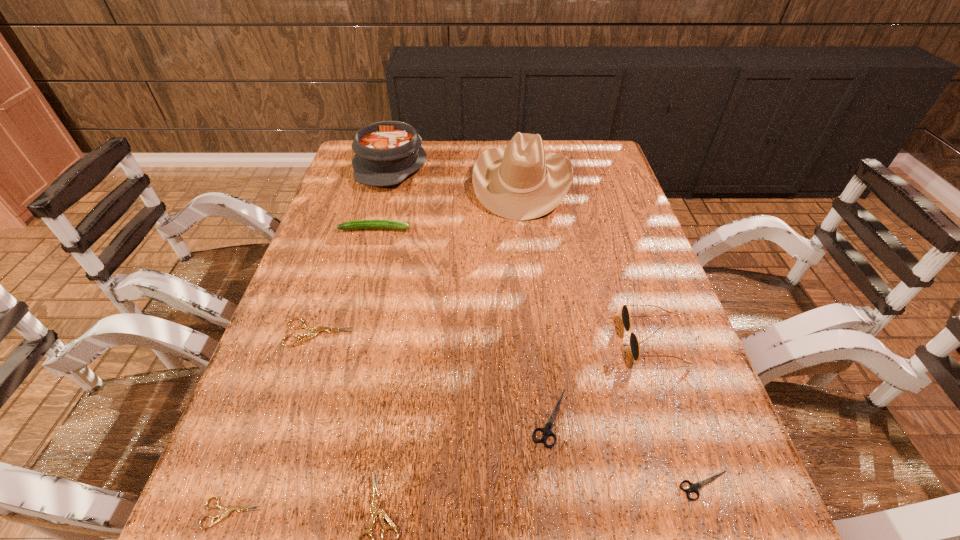
Locate an element on the screen. The width and height of the screenshot is (960, 540). brown cowboy hat is located at coordinates (521, 182).

What are the coordinates of `the tallest object` in the screenshot? It's located at (521, 182).

What are the coordinates of `the eighth shortest object` in the screenshot? It's located at (386, 153).

Find the location of a particular element. The height and width of the screenshot is (540, 960). casserole is located at coordinates (386, 153).

The height and width of the screenshot is (540, 960). I want to click on black sunglasses, so click(x=634, y=344).

At what (x,y) coordinates should I click in order to perform the action: click on the third tallest object. Please return your answer as a coordinate pair (x, y). This screenshot has height=540, width=960. Looking at the image, I should click on (634, 344).

This screenshot has height=540, width=960. In order to click on the seventh nearest object in this screenshot , I will do click(356, 224).

Locate an element on the screen. The width and height of the screenshot is (960, 540). the sixth shortest object is located at coordinates (356, 224).

Identify the location of the bigger black shears. (547, 431).

At what (x,y) coordinates should I click in order to perform the action: click on the fourth nearest shears. Please return your answer as a coordinate pair (x, y). This screenshot has width=960, height=540. Looking at the image, I should click on (547, 431).